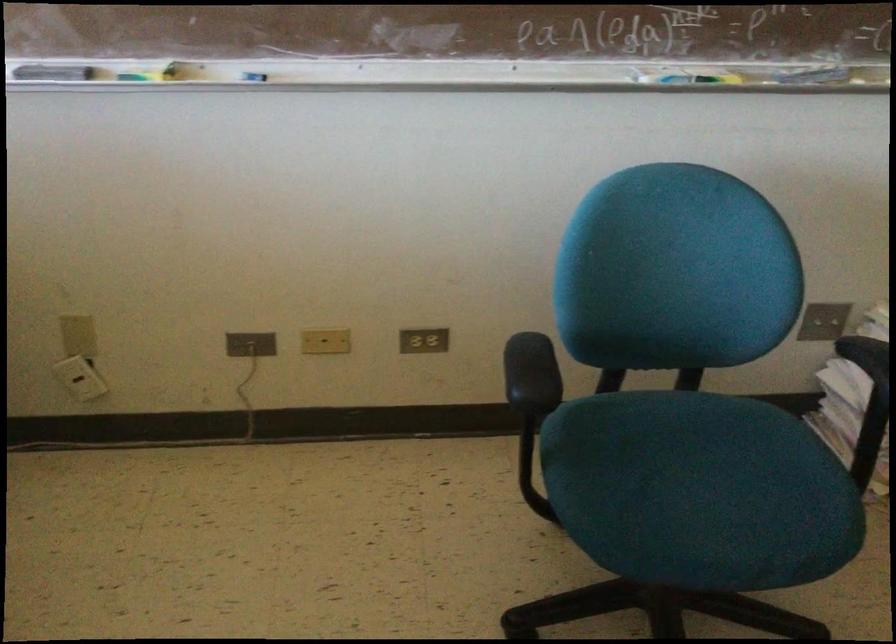
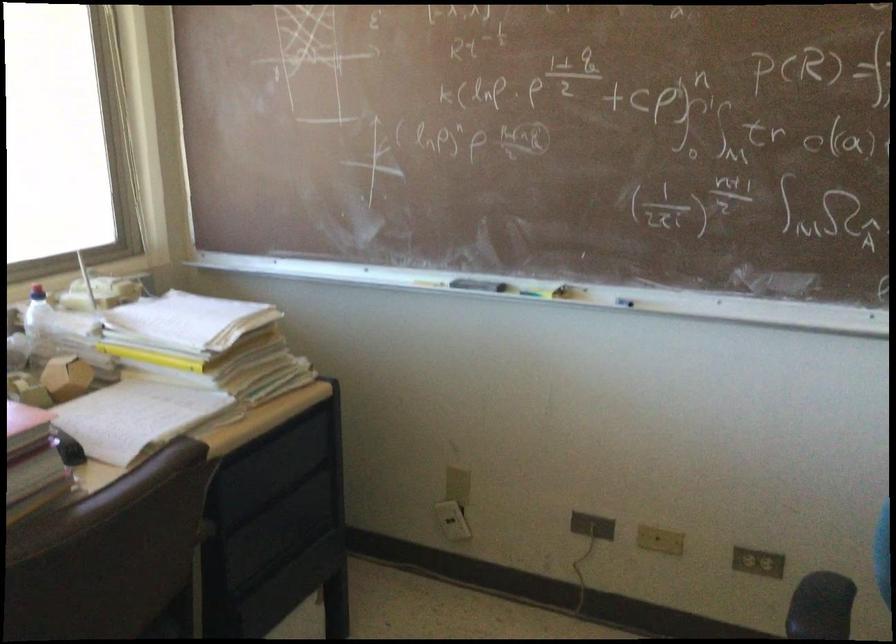
In the second image, find the point that corresponds to (x=254, y=79) in the first image.

(626, 304)